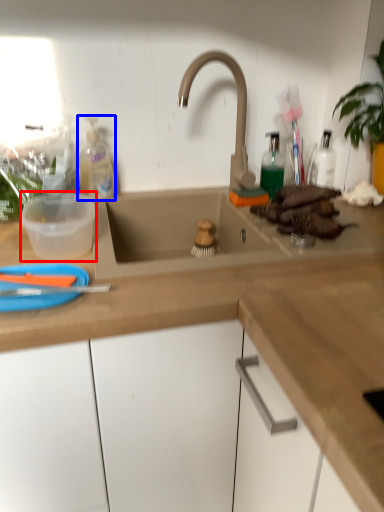
Question: Which of the following is the farthest to the observer, basin (highlighted by a red box) or cleaning product (highlighted by a blue box)?

Choices:
 (A) basin
 (B) cleaning product

Answer: (B)